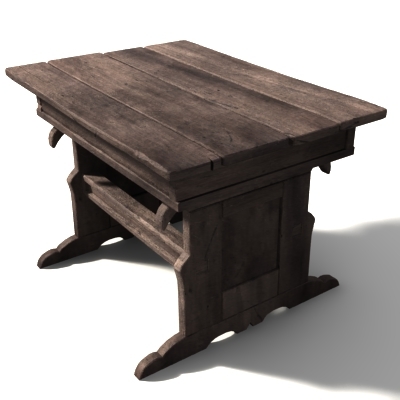
Find the location of a particular element. This screenshot has width=400, height=400. base of table is located at coordinates (200, 343), (74, 246).